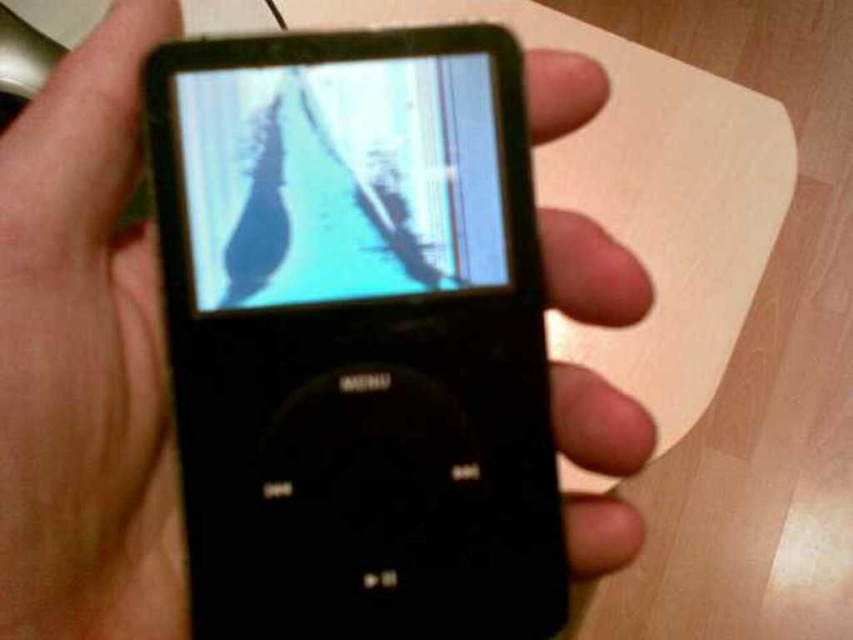
Question: Can you confirm if black matte ipod at center is smaller than matte plastic screen at center?

Choices:
 (A) yes
 (B) no

Answer: (B)

Question: Which of the following is the farthest from the observer?

Choices:
 (A) (374, 205)
 (B) (453, 269)

Answer: (B)

Question: In this image, where is black matte ipod at center located relative to matte plastic screen at center?

Choices:
 (A) left
 (B) right

Answer: (B)

Question: Among these points, which one is farthest from the camera?

Choices:
 (A) (517, 600)
 (B) (450, 97)

Answer: (B)

Question: From the image, what is the correct spatial relationship of black matte ipod at center in relation to matte plastic screen at center?

Choices:
 (A) below
 (B) above

Answer: (A)